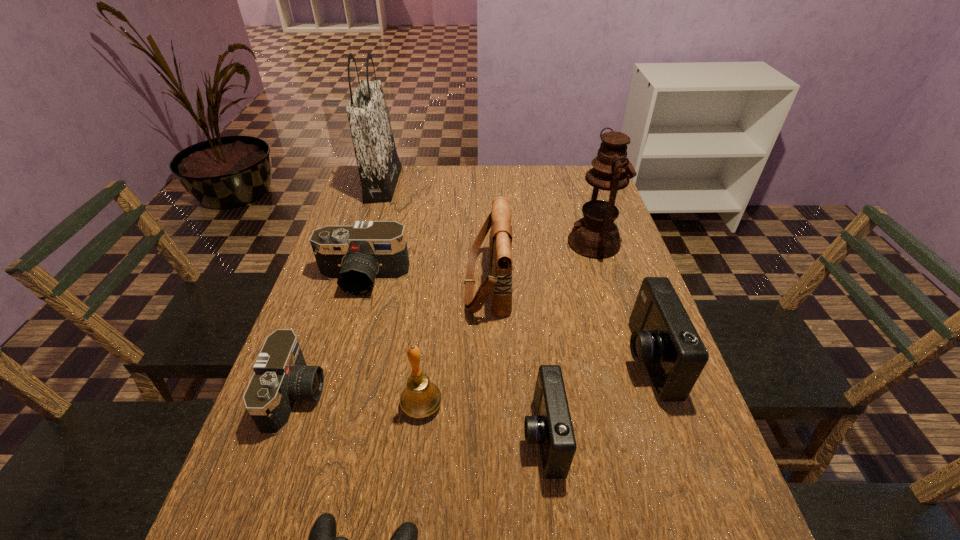
Locate an element on the screen. object located in the far left corner section of the desktop is located at coordinates (379, 167).

Find the location of a particular element. free region at the far edge of the desktop is located at coordinates coord(446,198).

Locate an element on the screen. vacant space at the left edge of the desktop is located at coordinates (348, 342).

This screenshot has height=540, width=960. What are the coordinates of `blank space at the right edge of the desktop` in the screenshot? It's located at (613, 361).

I want to click on vacant space at the far right corner of the desktop, so click(574, 172).

Find the location of a particular element. The image size is (960, 540). free point between the shoulder bag and the farthest camera is located at coordinates (425, 282).

The image size is (960, 540). What are the coordinates of `free spot between the fourth object from right to left and the bigger black camera` in the screenshot? It's located at pos(425,282).

This screenshot has width=960, height=540. Identify the location of vacant area that lies between the tallest object and the nearer black camera. (340, 290).

Identify the location of free space between the nearer black camera and the rightmost camera. The image size is (960, 540). (471, 377).

Identify the location of vacant point located between the smaller black camera and the eighth shortest object. This screenshot has height=540, width=960. (445, 319).